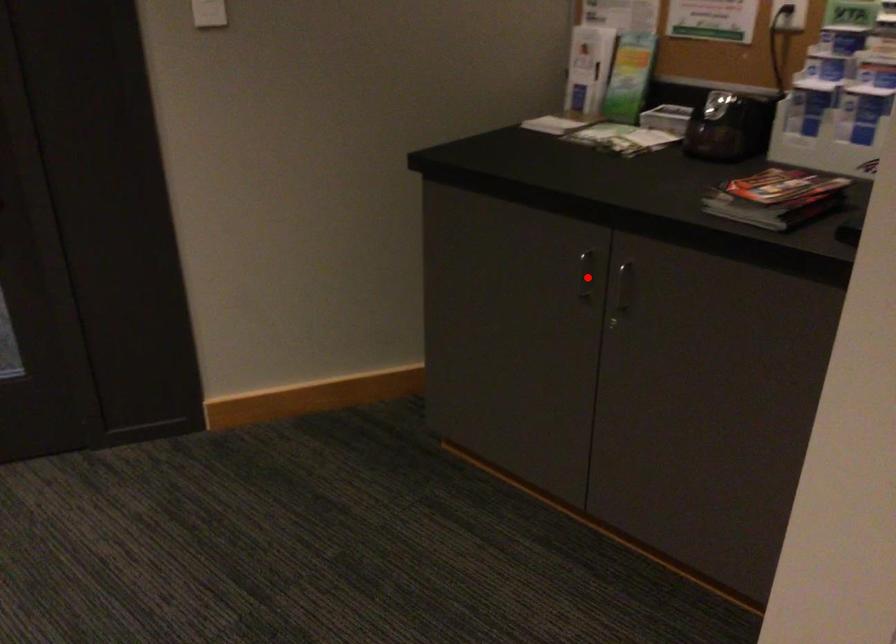
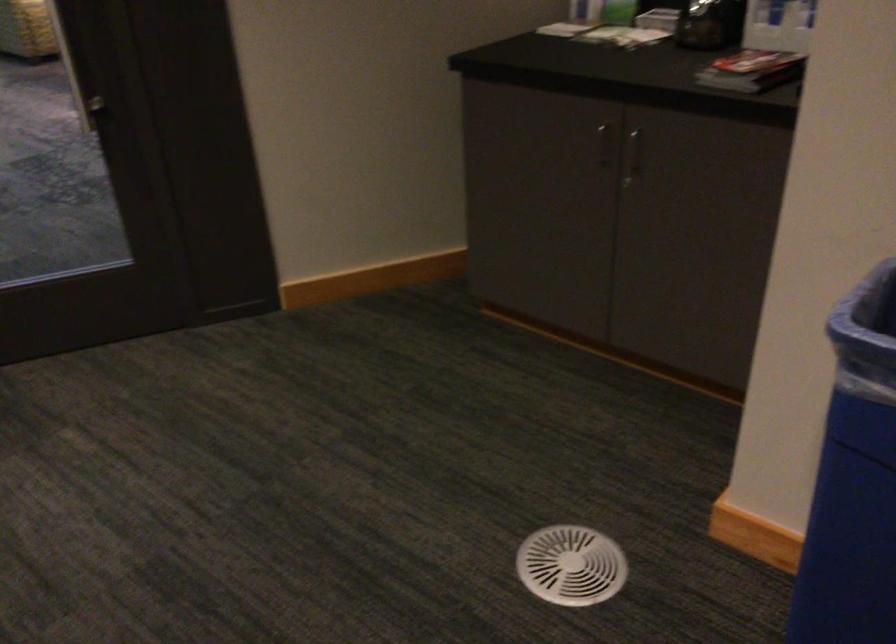
Where in the second image is the point corresponding to the highlighted location from the first image?

(604, 144)